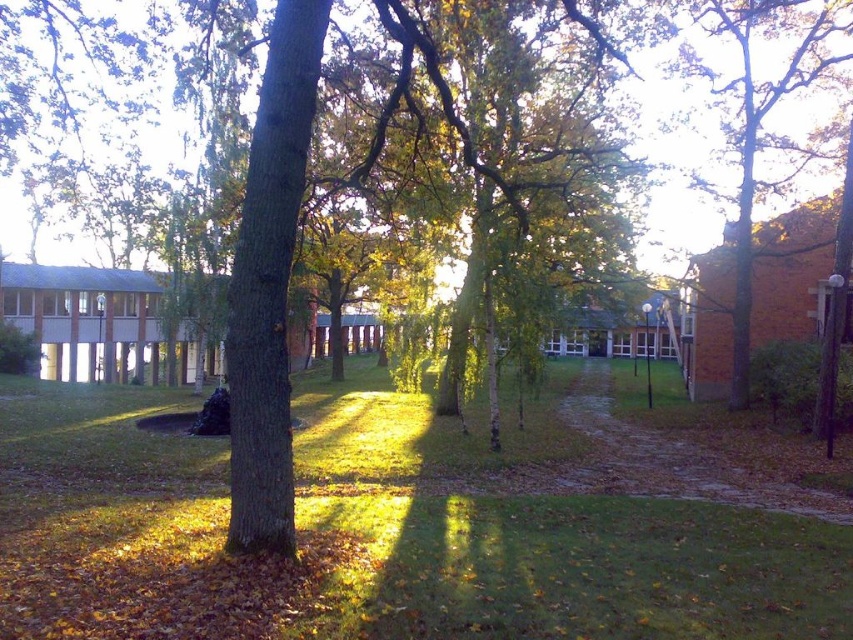
You are standing at the entrance of the park and want to reach the green grass at center. Which direction should you walk to get there from your current position?

The green grass at center is located at point (405, 525), so you should walk towards the center of the image from the entrance to reach it.

You are a gardener planning to mow the green grass at center and trim the brown textured tree at right. Which area requires more horizontal space to work on?

The green grass at center requires more horizontal space to work on since it might be wider than the brown textured tree at right according to the description.